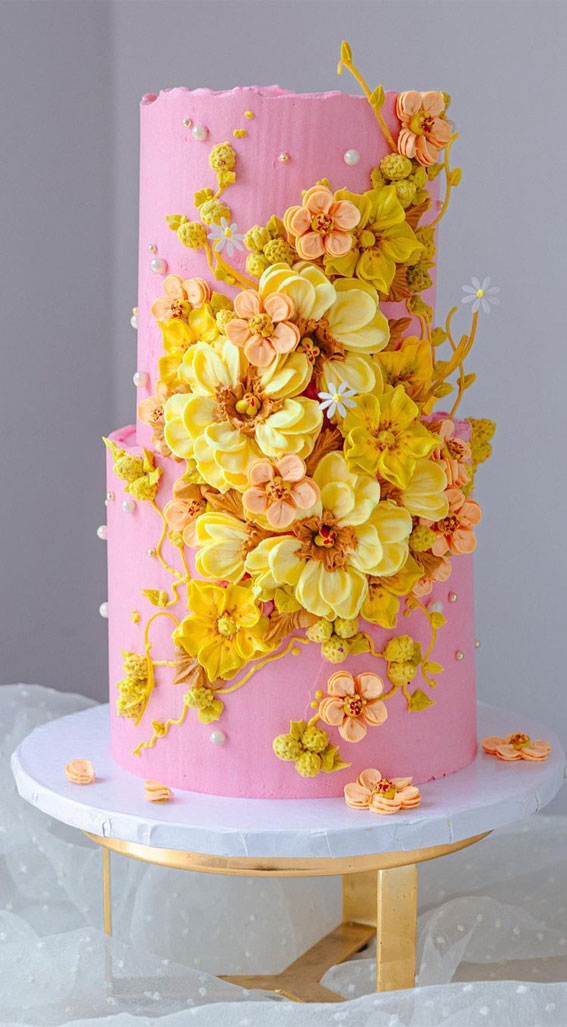
Where is `gold cake tray piece below base`? The width and height of the screenshot is (567, 1027). gold cake tray piece below base is located at coordinates (153, 851), (274, 865), (391, 861).